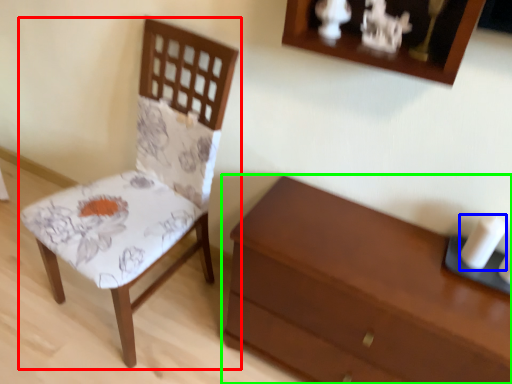
Question: Based on their relative distances, which object is nearer to chair (highlighted by a red box)? Choose from candle (highlighted by a blue box) and chest of drawers (highlighted by a green box).

Choices:
 (A) candle
 (B) chest of drawers

Answer: (B)